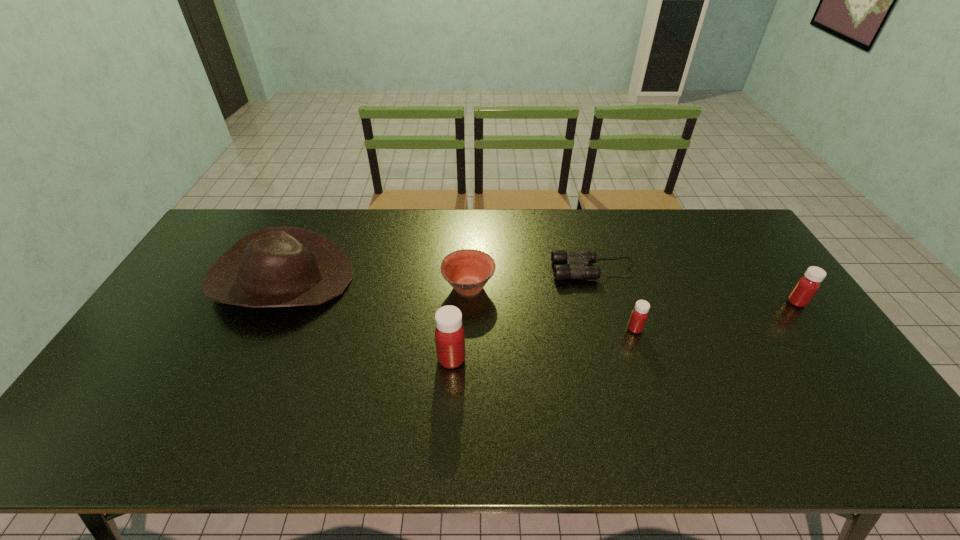
Locate an element on the screen. free space located on the back of the second medicine from right to left is located at coordinates (611, 255).

The image size is (960, 540). Identify the location of free space located 0.200m on the front of the fourth shortest object. (842, 364).

You are a GUI agent. You are given a task and a screenshot of the screen. Output one action in this format:
    pyautogui.click(x=<x>, y=<y>)
    Task: Click on the vacant region located 0.060m at the eyepiece of the shortest object
    
    Given the screenshot: What is the action you would take?
    pyautogui.click(x=534, y=269)

The height and width of the screenshot is (540, 960). What are the coordinates of `vacant space situated at the eyepiece of the shortest object` in the screenshot? It's located at (521, 269).

Image resolution: width=960 pixels, height=540 pixels. Identify the location of blank space located at the eyepiece of the shortest object. (506, 269).

Image resolution: width=960 pixels, height=540 pixels. What are the coordinates of `free location located on the front of the bowl` in the screenshot? It's located at (468, 324).

At what (x,y) coordinates should I click in order to perform the action: click on vacant area situated 0.270m on the front of the cowboy hat. Please return your answer as a coordinate pair (x, y). This screenshot has width=960, height=540. Looking at the image, I should click on (221, 409).

At what (x,y) coordinates should I click in order to perform the action: click on object that is at the far edge. Please return your answer as a coordinate pair (x, y). This screenshot has width=960, height=540. Looking at the image, I should click on (277, 266).

Locate an element on the screen. object positioned at the left edge is located at coordinates (277, 266).

Find the location of a particular element. object at the right edge is located at coordinates (806, 287).